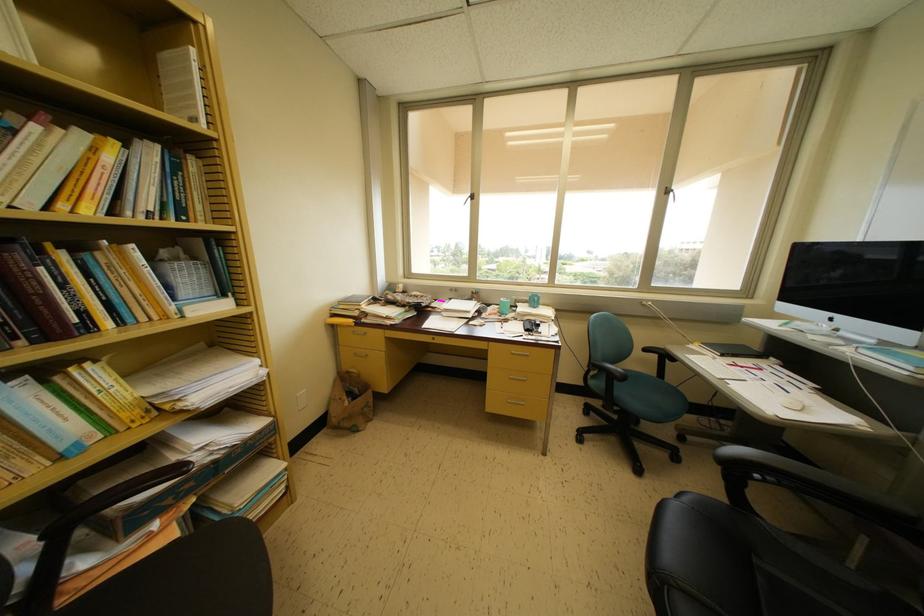
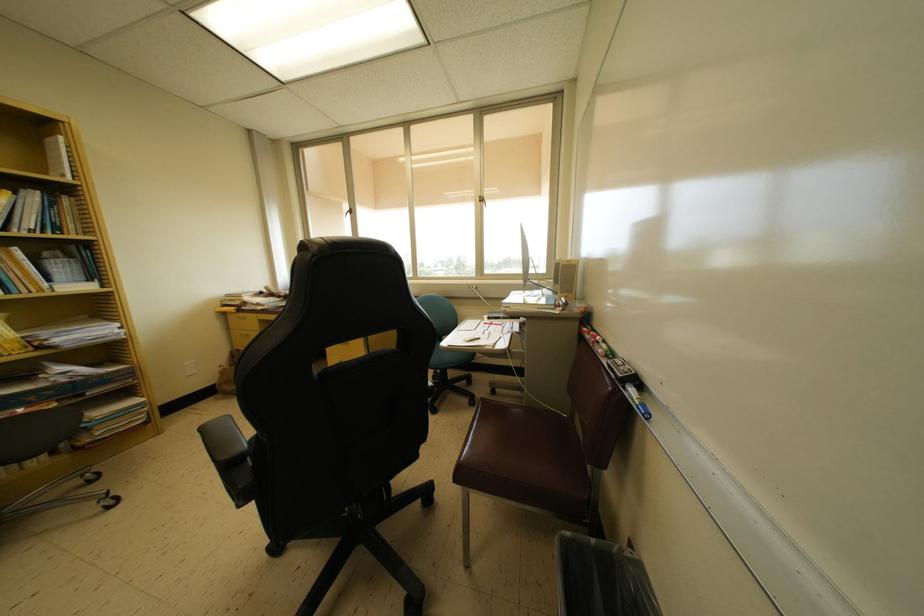
The point at (x=197, y=55) is marked in the first image. Where is the corresponding point in the second image?

(65, 143)